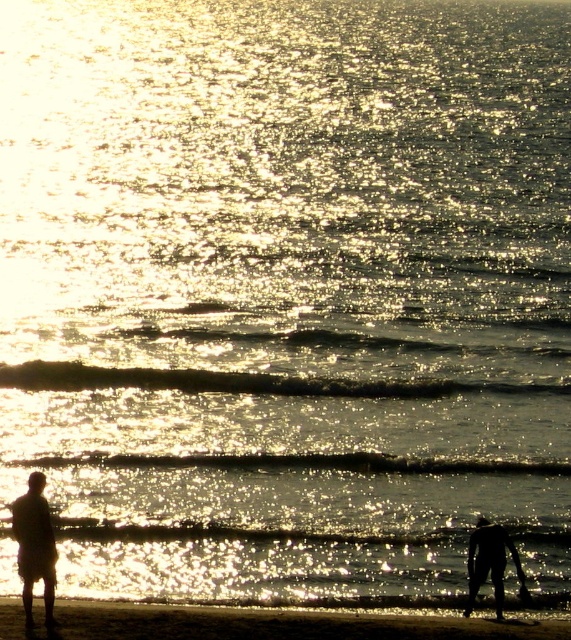
Consider the image. You are a photographer trying to capture the sunset scene. You need to position yourself so that the sandy beach at lower center and the silhouette figure at left are both in the frame. Given that your camera has a field of view of 5 meters, will you be able to include both subjects in your photo?

The sandy beach at lower center and silhouette figure at left are 3.89 meters apart from each other. Since the camera has a field of view of 5 meters, which is wider than the distance between them, you can include both subjects in your photo.

You are planning to build a small sandcastle on the sandy beach at lower center and want to place a flag on the black matte figure at lower right. Considering the space available, which location has more room for your sandcastle?

The sandy beach at lower center has more room for the sandcastle since it is wider than the black matte figure at lower right.

You are standing on the beach and see two points in the image. The first point is at coordinate point (x=142, y=612) and the second is at point (x=501, y=588). Which point is nearer to you?

Point (x=142, y=612) is closer to the viewer than point (x=501, y=588).